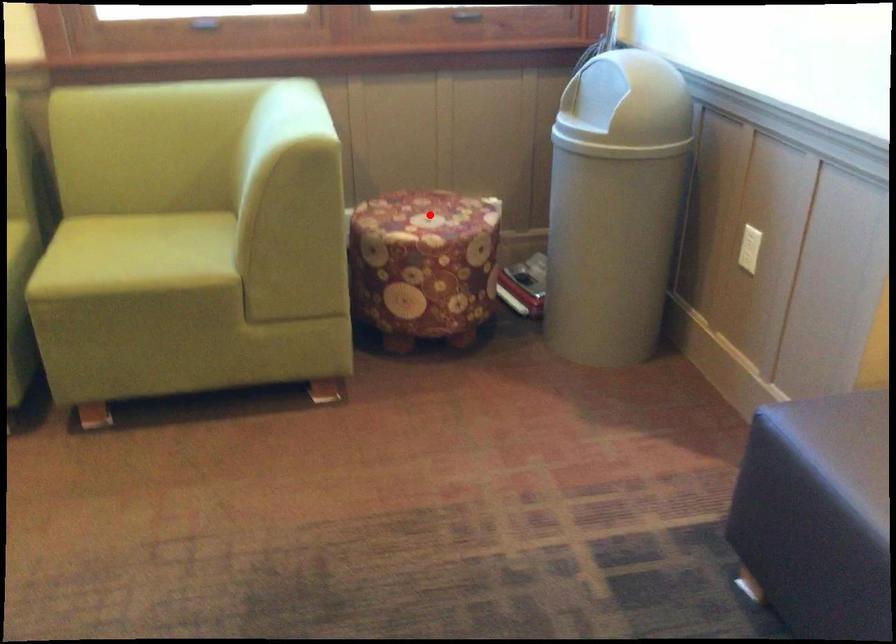
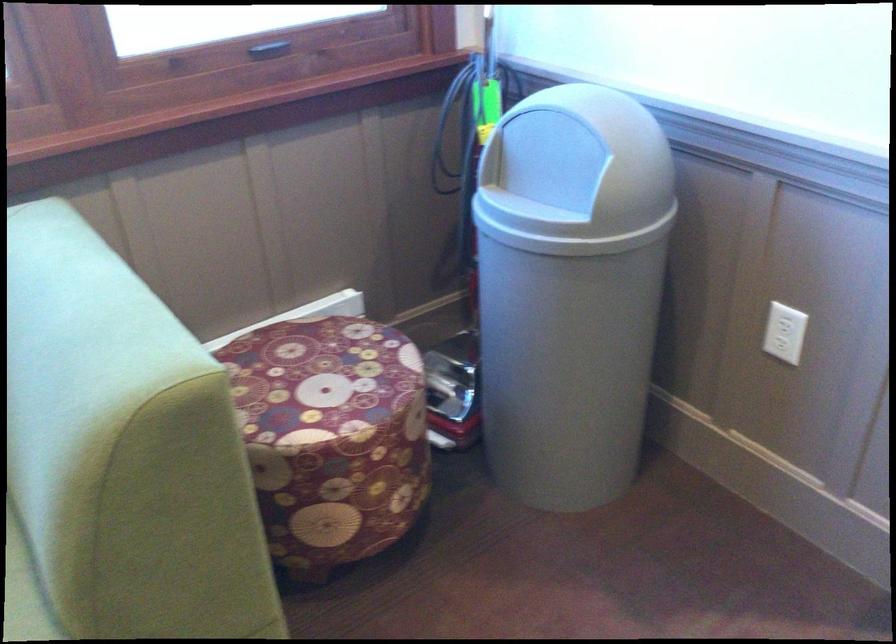
Question: I am providing you with two images of the same scene from different viewpoints. In image1, a red point is highlighted. Considering the same 3D point in image2, which of the following is correct?

Choices:
 (A) It is closer
 (B) It is farther

Answer: (A)